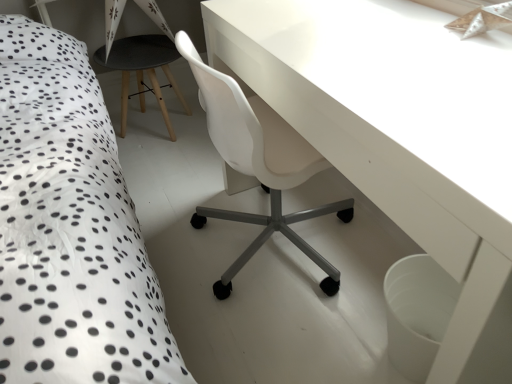
This screenshot has width=512, height=384. What do you see at coordinates (400, 137) in the screenshot? I see `white glossy table at center` at bounding box center [400, 137].

Find the location of a particular element. This screenshot has width=512, height=384. white glossy table at center is located at coordinates (400, 137).

Where is `black matte stool at center`? The width and height of the screenshot is (512, 384). black matte stool at center is located at coordinates (143, 70).

What do you see at coordinates (143, 70) in the screenshot?
I see `black matte stool at center` at bounding box center [143, 70].

Where is `white glossy table at center`? This screenshot has width=512, height=384. white glossy table at center is located at coordinates (400, 137).

Which is more to the left, white glossy table at center or black matte stool at center?

black matte stool at center.

Which object is more forward, white glossy table at center or black matte stool at center?

white glossy table at center is in front.

Considering the points (411, 228) and (118, 47), which point is behind, point (411, 228) or point (118, 47)?

The point (118, 47) is behind.

From the image's perspective, between white glossy table at center and black matte stool at center, which one is located above?

black matte stool at center appears higher in the image.

From a real-world perspective, which object rests below the other?

black matte stool at center, from a real-world perspective.

In the scene shown: Which of these two, white glossy table at center or black matte stool at center, is wider?

black matte stool at center is wider.

Considering the sizes of objects white glossy table at center and black matte stool at center in the image provided, who is taller, white glossy table at center or black matte stool at center?

white glossy table at center.

Considering the relative sizes of white glossy table at center and black matte stool at center in the image provided, is white glossy table at center smaller than black matte stool at center?

Incorrect, white glossy table at center is not smaller in size than black matte stool at center.

Is black matte stool at center located within white glossy table at center?

No, black matte stool at center is not a part of white glossy table at center.

Does white glossy table at center touch black matte stool at center?

white glossy table at center and black matte stool at center are not in contact.

Is white glossy table at center oriented towards black matte stool at center?

No, white glossy table at center does not turn towards black matte stool at center.

At what (x,y) coordinates should I click in order to perform the action: click on bar stool above the white glossy table at center (from the image's perspective). Please return your answer as a coordinate pair (x, y). This screenshot has height=384, width=512. Looking at the image, I should click on (143, 70).

Considering the positions of objects black matte stool at center and white glossy table at center in the image provided, who is more to the right, black matte stool at center or white glossy table at center?

From the viewer's perspective, white glossy table at center appears more on the right side.

Which object is more forward, black matte stool at center or white glossy table at center?

white glossy table at center is in front.

Is point (126, 45) farther from viewer compared to point (425, 56)?

Yes, it is.

From the image's perspective, is black matte stool at center on top of white glossy table at center?

Yes.

From a real-world perspective, is black matte stool at center positioned above or below white glossy table at center?

From a real-world perspective, black matte stool at center is physically below white glossy table at center.

Considering the relative sizes of black matte stool at center and white glossy table at center in the image provided, is black matte stool at center wider than white glossy table at center?

Yes, black matte stool at center is wider than white glossy table at center.

Can you confirm if black matte stool at center is shorter than white glossy table at center?

Yes, black matte stool at center is shorter than white glossy table at center.

Which of these two, black matte stool at center or white glossy table at center, is smaller?

With smaller size is black matte stool at center.

Would you say black matte stool at center is inside or outside white glossy table at center?

black matte stool at center cannot be found inside white glossy table at center.

Is black matte stool at center positioned far away from white glossy table at center?

Indeed, black matte stool at center is not near white glossy table at center.

Is black matte stool at center facing towards white glossy table at center?

Yes, black matte stool at center is aimed at white glossy table at center.

Image resolution: width=512 pixels, height=384 pixels. I want to click on table located on the right of black matte stool at center, so click(400, 137).

I want to click on table on the right of the black matte stool at center, so click(400, 137).

Where is `table below the black matte stool at center (from the image's perspective)`? The image size is (512, 384). table below the black matte stool at center (from the image's perspective) is located at coordinates (400, 137).